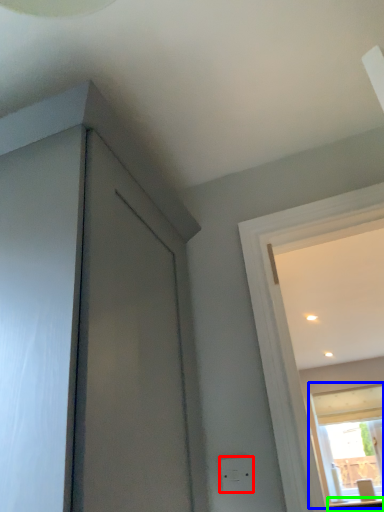
Question: Based on their relative distances, which object is farther from electric outlet (highlighted by a red box)? Choose from window (highlighted by a blue box) and counter top (highlighted by a green box).

Choices:
 (A) window
 (B) counter top

Answer: (A)